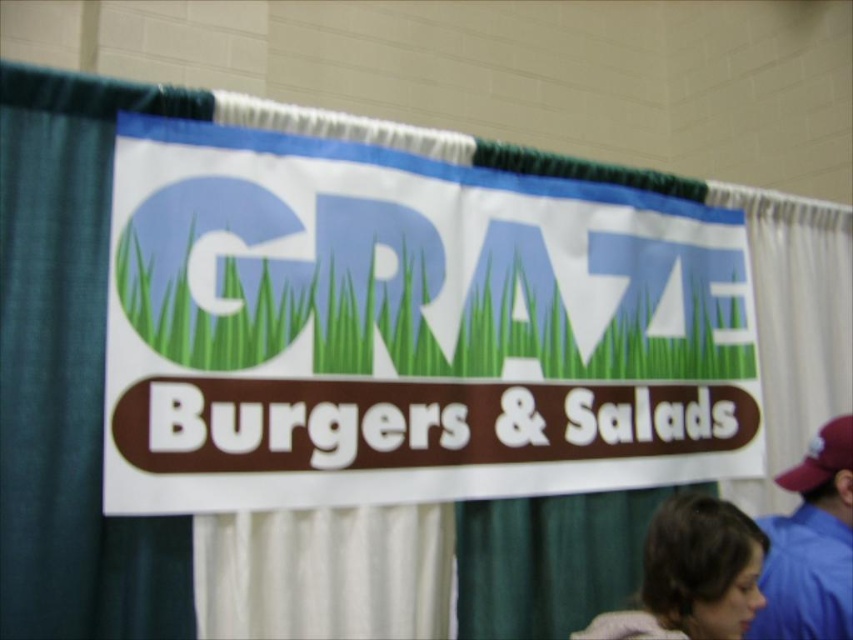
Question: Can you confirm if white paper sign at center is positioned above brown hair at lower right?

Choices:
 (A) no
 (B) yes

Answer: (B)

Question: Does brown hair at lower right come in front of blue fabric cap at upper right?

Choices:
 (A) yes
 (B) no

Answer: (A)

Question: Considering the real-world distances, which object is closest to the white paper sign at center?

Choices:
 (A) brown hair at lower right
 (B) blue fabric cap at upper right

Answer: (A)

Question: Does brown hair at lower right have a smaller size compared to blue fabric cap at upper right?

Choices:
 (A) yes
 (B) no

Answer: (A)

Question: Which of these objects is positioned closest to the blue fabric cap at upper right?

Choices:
 (A) brown hair at lower right
 (B) white paper sign at center

Answer: (A)

Question: Which point is farther from the camera taking this photo?

Choices:
 (A) (850, 561)
 (B) (674, 579)
 (C) (465, 228)

Answer: (C)